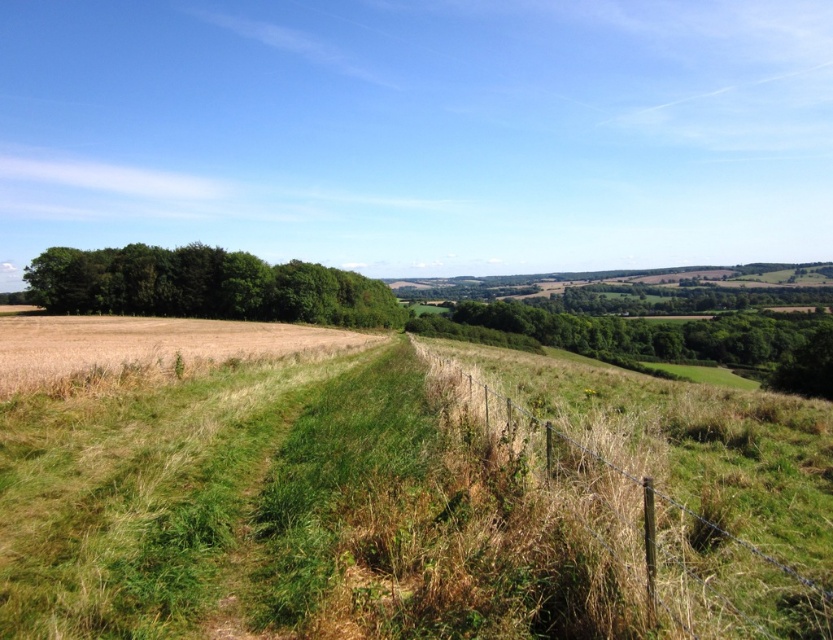
Question: Which point is farther to the camera?

Choices:
 (A) brown wire fence at right
 (B) green leafy trees at left

Answer: (B)

Question: Does brown wire fence at right have a smaller size compared to green leafy trees at left?

Choices:
 (A) no
 (B) yes

Answer: (B)

Question: Which object appears closest to the camera in this image?

Choices:
 (A) green leafy trees at left
 (B) brown wire fence at right

Answer: (B)

Question: Considering the relative positions of brown wire fence at right and green leafy trees at left in the image provided, where is brown wire fence at right located with respect to green leafy trees at left?

Choices:
 (A) below
 (B) above

Answer: (A)

Question: Which point is closer to the camera?

Choices:
 (A) (802, 618)
 (B) (388, 294)
 (C) (193, 355)

Answer: (A)

Question: Can you confirm if green leafy trees at left is wider than golden matte wheat field at left?

Choices:
 (A) no
 (B) yes

Answer: (B)